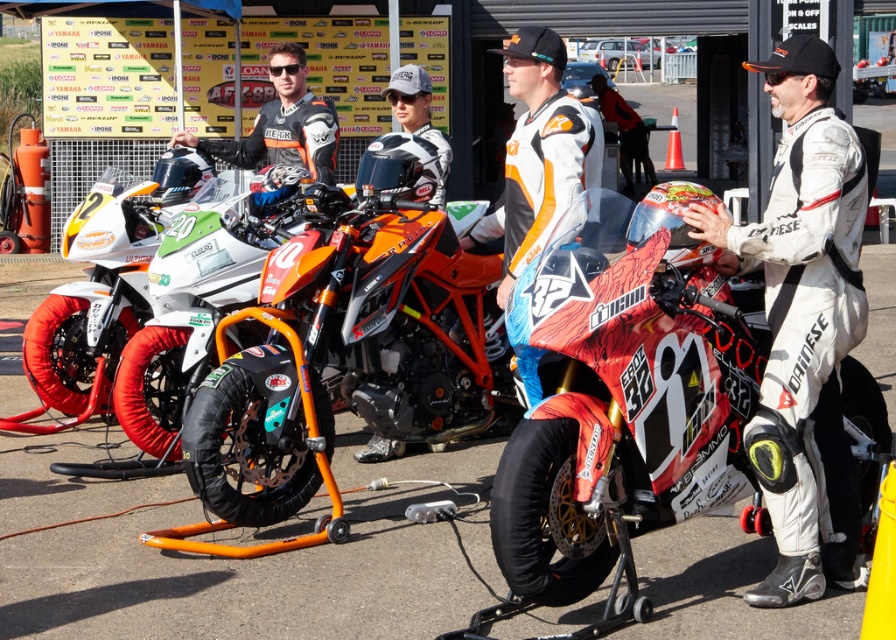
You are a photographer at the motorcycle event. You want to take a photo of the orange matte motorcycle at center and the matte black jacket at center. Which object should you zoom in on to ensure both fit in the frame without cropping?

The orange matte motorcycle at center is bigger than the matte black jacket at center, so you should zoom out to include both objects in the frame without cropping.

You are a photographer at the motorcycle event. You need to capture a photo that includes both the orange matte motorcycle at center and the orange and white racing suit at center. Based on their positions, which object is located above the other?

The orange and white racing suit at center is above the orange matte motorcycle at center because the motorcycle is positioned under the racing suit according to the description.

You are a photographer at the motorcycle event and want to capture a photo of both the orange matte motorcycle at center and the orange and white racing suit at center in a single frame. Since your camera has a fixed focal length, you need to know which object is wider to adjust the framing properly. Which object has a greater width?

The orange matte motorcycle at center has a greater width than the orange and white racing suit at center, so you should frame the shot to accommodate the motorcycle first.